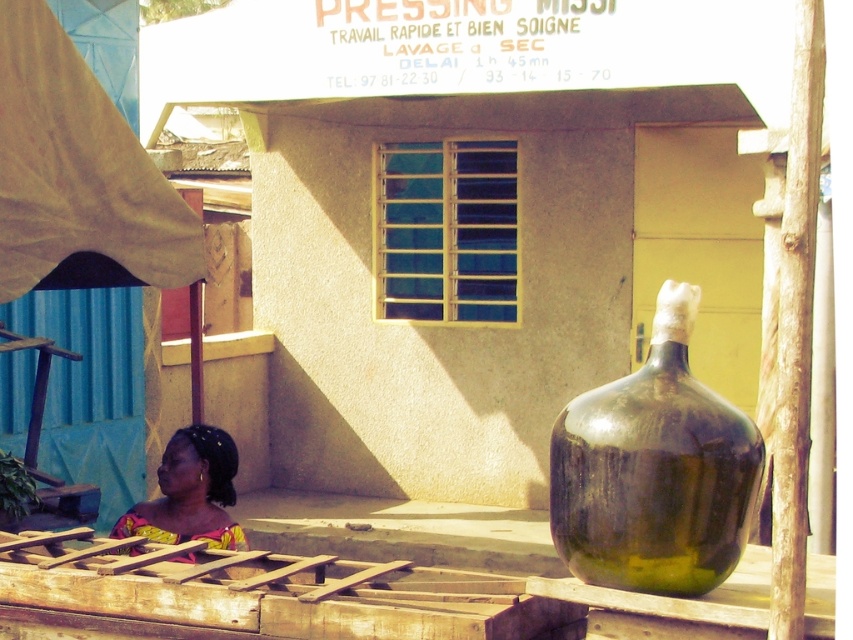
You are a delivery person with a box that is 3 meters long. You need to place the box between the green glass vase at center and the yellow printed fabric at lower left. Is there enough space to fit the box between them?

The distance between the green glass vase at center and the yellow printed fabric at lower left is 2.95 meters. Since the box is 3 meters long, it is slightly too long to fit in the available space.

You are a customer looking to place an order at the laundry shop. You have a large yellow printed fabric at lower left that needs pressing. Can the green glass vase at center on the counter fit your fabric? Please explain based on their sizes.

The green glass vase at center is wider than the yellow printed fabric at lower left. Since the vase is wider, it should be able to accommodate the fabric.

You are standing in front of the building and notice the green glass vase at center and the yellow printed fabric at lower left. Which object is nearer to you?

The green glass vase at center is closer to the viewer than the yellow printed fabric at lower left.